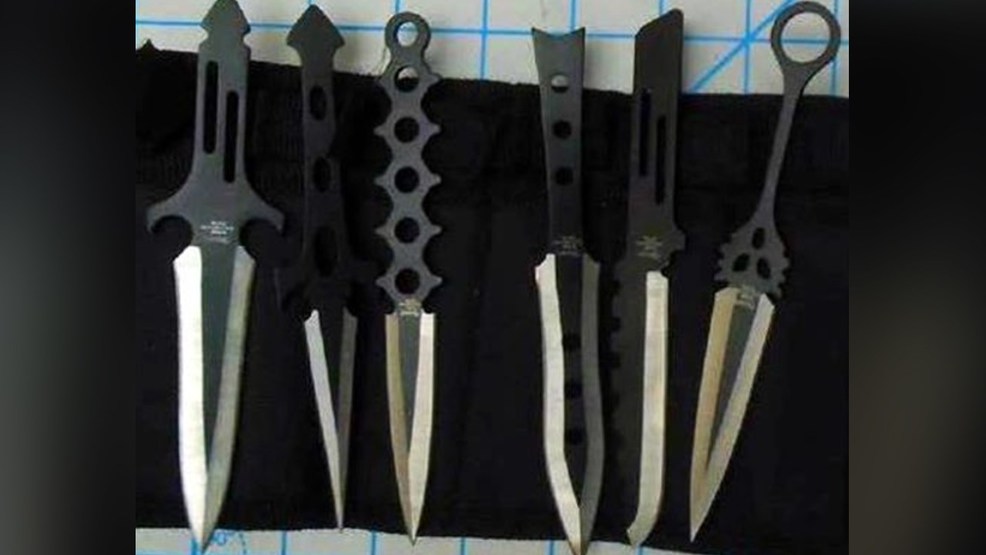
This screenshot has width=986, height=555. Identify the location of hole handle. (408, 261), (404, 157), (404, 51).